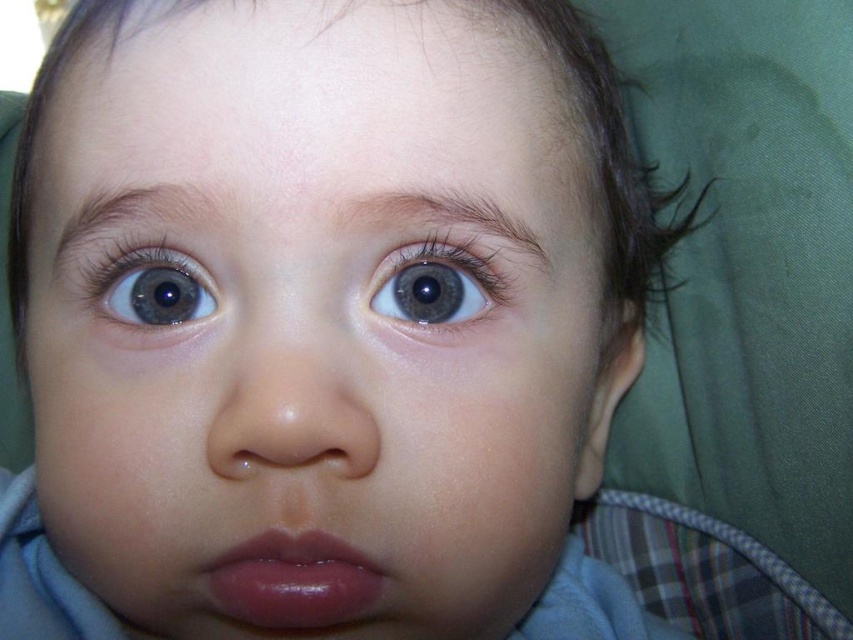
Question: Can you confirm if smooth skin face at center is positioned above blue glossy eye at upper center?

Choices:
 (A) yes
 (B) no

Answer: (B)

Question: In this image, where is smooth skin face at center located relative to blue glossy eye at upper center?

Choices:
 (A) right
 (B) left

Answer: (B)

Question: Which object appears farthest from the camera in this image?

Choices:
 (A) blue glossy eye at upper center
 (B) glossy pink lips at center
 (C) smooth skin face at center
 (D) blue glossy eye at upper left

Answer: (D)

Question: Which object appears farthest from the camera in this image?

Choices:
 (A) blue glossy eye at upper left
 (B) blue glossy eye at upper center

Answer: (A)

Question: Which is farther from the blue glossy eye at upper left?

Choices:
 (A) blue glossy eye at upper center
 (B) smooth skin face at center

Answer: (B)

Question: Is smooth skin face at center positioned behind blue glossy eye at upper center?

Choices:
 (A) no
 (B) yes

Answer: (A)